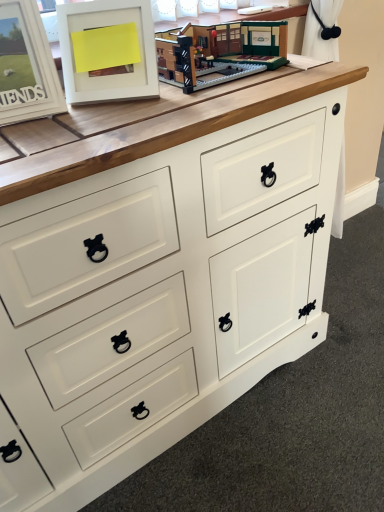
Measure the distance between white matte picture frame at upper left, which is counted as the 1th picture frame, starting from the right, and camera.

30.39 inches.

At what (x,y) coordinates should I click in order to perform the action: click on brick-like lego set at upper center. Please return your answer as a coordinate pair (x, y). Looking at the image, I should click on (219, 52).

From a real-world perspective, is white matte picture frame at upper left, which is the second picture frame in right-to-left order, over white matte picture frame at upper left, which is counted as the 1th picture frame, starting from the right?

Yes, from a real-world perspective, white matte picture frame at upper left, which is the second picture frame in right-to-left order, is over white matte picture frame at upper left, which is counted as the 1th picture frame, starting from the right

Is white matte picture frame at upper left, the first picture frame from the left, shorter than white matte picture frame at upper left, which is counted as the 1th picture frame, starting from the right?

Correct, white matte picture frame at upper left, the first picture frame from the left, is not as tall as white matte picture frame at upper left, which is counted as the 1th picture frame, starting from the right.

Between white matte picture frame at upper left, the first picture frame from the left, and white matte picture frame at upper left, which is counted as the 1th picture frame, starting from the right, which one has smaller size?

white matte picture frame at upper left, the first picture frame from the left, is smaller.

Is white matte picture frame at upper left, which is the second picture frame in right-to-left order, positioned in front of white matte picture frame at upper left, the second picture frame positioned from the left?

Yes, it is.

Can you tell me how much white matte picture frame at upper left, which is the second picture frame in right-to-left order, and brick-like lego set at upper center differ in facing direction?

white matte picture frame at upper left, which is the second picture frame in right-to-left order, and brick-like lego set at upper center are facing 7.07 degrees away from each other.

Is white matte picture frame at upper left, the first picture frame from the left, positioned far away from brick-like lego set at upper center?

No, there isn't a large distance between white matte picture frame at upper left, the first picture frame from the left, and brick-like lego set at upper center.

Is white matte picture frame at upper left, the first picture frame from the left, aimed at brick-like lego set at upper center?

No.

Do you think white matte picture frame at upper left, the first picture frame from the left, is within brick-like lego set at upper center, or outside of it?

white matte picture frame at upper left, the first picture frame from the left, is located beyond the bounds of brick-like lego set at upper center.

Looking at their sizes, would you say white matte picture frame at upper left, which is counted as the 1th picture frame, starting from the right, is wider or thinner than white matte picture frame at upper left, the first picture frame from the left?

white matte picture frame at upper left, which is counted as the 1th picture frame, starting from the right, is wider than white matte picture frame at upper left, the first picture frame from the left.

Could you tell me if white matte picture frame at upper left, which is counted as the 1th picture frame, starting from the right, is facing white matte picture frame at upper left, which is the second picture frame in right-to-left order?

No, white matte picture frame at upper left, which is counted as the 1th picture frame, starting from the right, does not turn towards white matte picture frame at upper left, which is the second picture frame in right-to-left order.

Is white matte picture frame at upper left, which is counted as the 1th picture frame, starting from the right, positioned far away from white matte picture frame at upper left, which is the second picture frame in right-to-left order?

white matte picture frame at upper left, which is counted as the 1th picture frame, starting from the right, is actually quite close to white matte picture frame at upper left, which is the second picture frame in right-to-left order.

From a real-world perspective, who is located higher, white matte picture frame at upper left, which is counted as the 1th picture frame, starting from the right, or white matte picture frame at upper left, the first picture frame from the left?

In real-world perspective, white matte picture frame at upper left, the first picture frame from the left, is above.

Is brick-like lego set at upper center spatially inside white matte picture frame at upper left, the first picture frame from the left, or outside of it?

brick-like lego set at upper center is not enclosed by white matte picture frame at upper left, the first picture frame from the left.

You are a GUI agent. You are given a task and a screenshot of the screen. Output one action in this format:
    pyautogui.click(x=<x>, y=<y>)
    Task: Click on the 2nd picture frame counting from the left side of the brick-like lego set at upper center
    The image size is (384, 512).
    Given the screenshot: What is the action you would take?
    pyautogui.click(x=26, y=65)

Who is taller, brick-like lego set at upper center or white matte picture frame at upper left, which is the second picture frame in right-to-left order?

Standing taller between the two is white matte picture frame at upper left, which is the second picture frame in right-to-left order.

Do you think white matte picture frame at upper left, the second picture frame positioned from the left, is within brick-like lego set at upper center, or outside of it?

white matte picture frame at upper left, the second picture frame positioned from the left, is spatially situated outside brick-like lego set at upper center.

Is brick-like lego set at upper center at the back of white matte picture frame at upper left, which is counted as the 1th picture frame, starting from the right?

Result: white matte picture frame at upper left, which is counted as the 1th picture frame, starting from the right, is not turned away from brick-like lego set at upper center.

From a real-world perspective, starting from the brick-like lego set at upper center, which picture frame is the 1st one vertically above it? Please provide its 2D coordinates.

[(105, 63)]

From the image's perspective, which one is positioned higher, brick-like lego set at upper center or white matte picture frame at upper left, which is counted as the 1th picture frame, starting from the right?

From the image's view, brick-like lego set at upper center is above.

Considering the relative sizes of brick-like lego set at upper center and white matte picture frame at upper left, which is counted as the 1th picture frame, starting from the right, in the image provided, is brick-like lego set at upper center bigger than white matte picture frame at upper left, which is counted as the 1th picture frame, starting from the right,?

No.

From a real-world perspective, between brick-like lego set at upper center and white matte picture frame at upper left, the second picture frame positioned from the left, who is vertically lower?

brick-like lego set at upper center, from a real-world perspective.

Where is `picture frame located underneath the white matte picture frame at upper left, the first picture frame from the left (from a real-world perspective)`? This screenshot has height=512, width=384. picture frame located underneath the white matte picture frame at upper left, the first picture frame from the left (from a real-world perspective) is located at coordinates (105, 63).

You are a GUI agent. You are given a task and a screenshot of the screen. Output one action in this format:
    pyautogui.click(x=<x>, y=<y>)
    Task: Click on the 2nd picture frame in front of the brick-like lego set at upper center
    Image resolution: width=384 pixels, height=512 pixels.
    Given the screenshot: What is the action you would take?
    pyautogui.click(x=26, y=65)

When comparing their distances from white matte picture frame at upper left, which is counted as the 1th picture frame, starting from the right, does brick-like lego set at upper center or white matte picture frame at upper left, the first picture frame from the left, seem closer?

Among the two, white matte picture frame at upper left, the first picture frame from the left, is located nearer to white matte picture frame at upper left, which is counted as the 1th picture frame, starting from the right.

Estimate the real-world distances between objects in this image. Which object is further from brick-like lego set at upper center, white matte picture frame at upper left, the second picture frame positioned from the left, or white matte picture frame at upper left, which is the second picture frame in right-to-left order?

white matte picture frame at upper left, which is the second picture frame in right-to-left order, lies further to brick-like lego set at upper center than the other object.

Based on their spatial positions, is white matte picture frame at upper left, the first picture frame from the left, or brick-like lego set at upper center closer to white matte picture frame at upper left, which is counted as the 1th picture frame, starting from the right?

The object closer to white matte picture frame at upper left, which is counted as the 1th picture frame, starting from the right, is white matte picture frame at upper left, the first picture frame from the left.

From the picture: Considering their positions, is white matte picture frame at upper left, which is the second picture frame in right-to-left order, positioned closer to brick-like lego set at upper center than white matte picture frame at upper left, which is counted as the 1th picture frame, starting from the right?

Among the two, white matte picture frame at upper left, which is counted as the 1th picture frame, starting from the right, is located nearer to brick-like lego set at upper center.

Which object lies nearer to the anchor point white matte picture frame at upper left, the first picture frame from the left, white matte picture frame at upper left, the second picture frame positioned from the left, or brick-like lego set at upper center?

white matte picture frame at upper left, the second picture frame positioned from the left.

Considering their positions, is brick-like lego set at upper center positioned closer to white matte picture frame at upper left, which is the second picture frame in right-to-left order, than white matte picture frame at upper left, which is counted as the 1th picture frame, starting from the right?

white matte picture frame at upper left, which is counted as the 1th picture frame, starting from the right, is positioned closer to the anchor white matte picture frame at upper left, which is the second picture frame in right-to-left order.

The image size is (384, 512). What are the coordinates of `picture frame between white matte picture frame at upper left, which is the second picture frame in right-to-left order, and brick-like lego set at upper center, in the horizontal direction` in the screenshot? It's located at (105, 63).